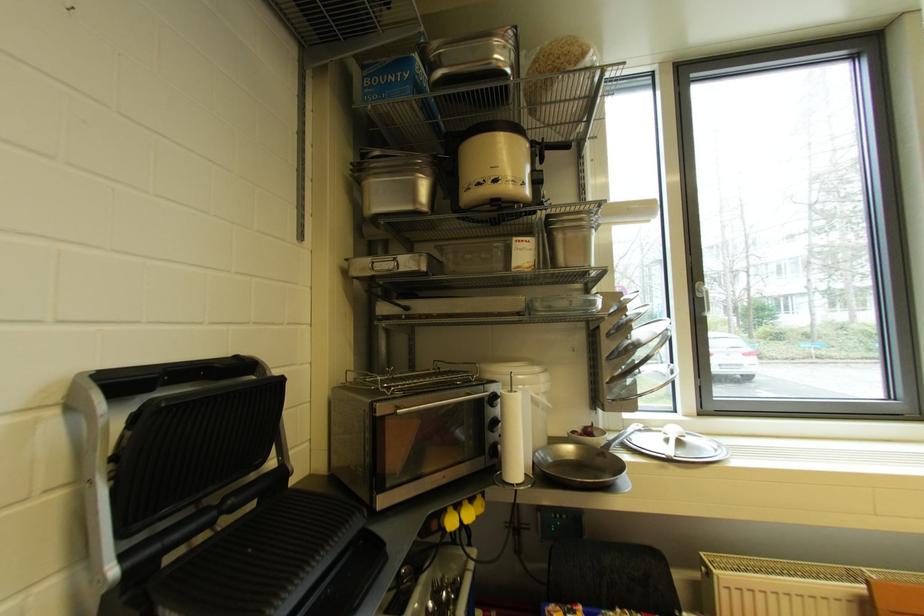
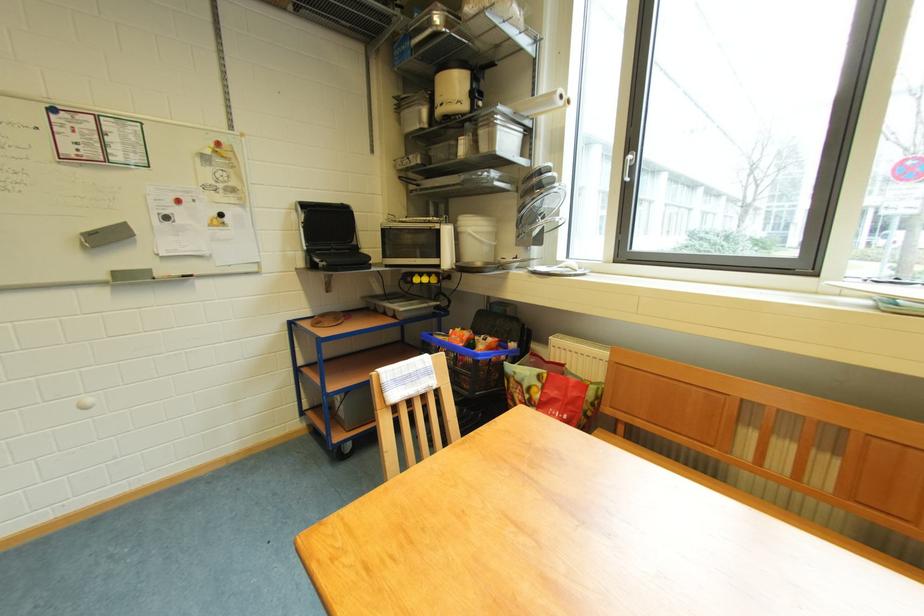
Find the pixel in the second image that matches the point at 442,528 in the first image.

(417, 282)